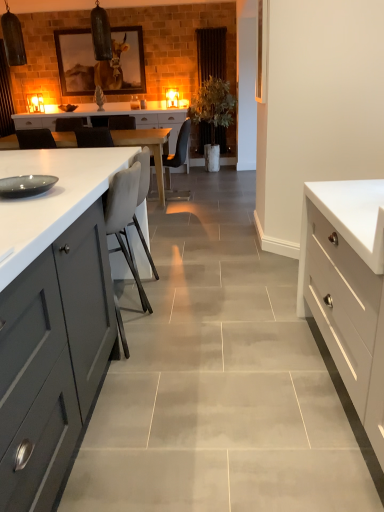
Question: From a real-world perspective, is matte black chair at center, which is the 2th chair in front-to-back order, positioned above or below wooden framed picture at upper center?

Choices:
 (A) below
 (B) above

Answer: (A)

Question: Relative to wooden framed picture at upper center, is matte black chair at center, which is the 2th chair in front-to-back order, in front or behind?

Choices:
 (A) behind
 (B) front

Answer: (B)

Question: Estimate the real-world distances between objects in this image. Which object is closer to the matte black chair at center, marked as the 1th chair in a top-to-bottom arrangement?

Choices:
 (A) green leafy plant at center
 (B) white glossy drawer at right
 (C) white matte chair at center, the first chair ordered from the bottom
 (D) wooden framed picture at upper center

Answer: (A)

Question: Estimate the real-world distances between objects in this image. Which object is closer to the green leafy plant at center?

Choices:
 (A) matte black chair at center, the 1th chair from the back
 (B) white matte chair at center, which is the 2th chair from back to front
 (C) white glossy drawer at right
 (D) wooden framed picture at upper center

Answer: (A)